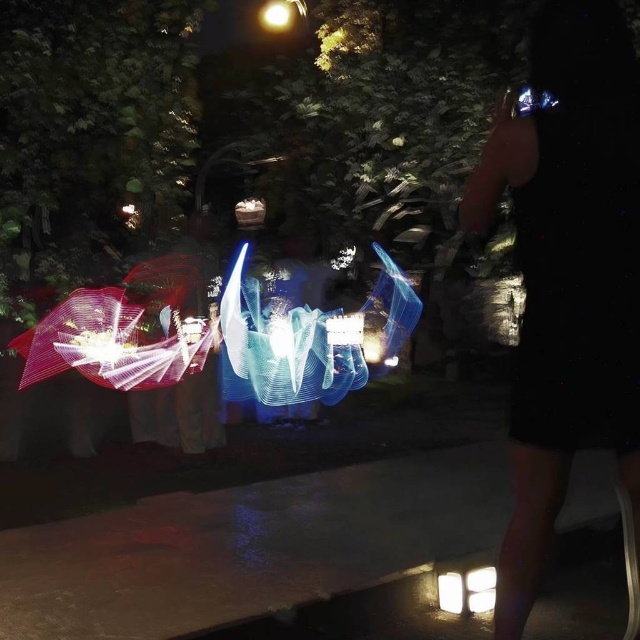
Question: Is white glossy light at lower center wider than matte white light at upper center?

Choices:
 (A) yes
 (B) no

Answer: (B)

Question: Can you confirm if metallic silver bracelet at upper right is smaller than white glossy light at lower center?

Choices:
 (A) yes
 (B) no

Answer: (B)

Question: Estimate the real-world distances between objects in this image. Which object is farther from the white glossy square at lower right?

Choices:
 (A) white glossy light at lower center
 (B) metallic silver bracelet at upper right
 (C) matte white light at upper center

Answer: (C)

Question: Is metallic silver bracelet at upper right above matte white light at upper center?

Choices:
 (A) no
 (B) yes

Answer: (A)

Question: Which object is positioned closest to the matte white light at upper center?

Choices:
 (A) white glossy square at lower right
 (B) metallic silver bracelet at upper right
 (C) white glossy light at lower center

Answer: (B)

Question: Which point is closer to the camera?

Choices:
 (A) white glossy light at lower center
 (B) matte white light at upper center
 (C) metallic silver bracelet at upper right

Answer: (C)